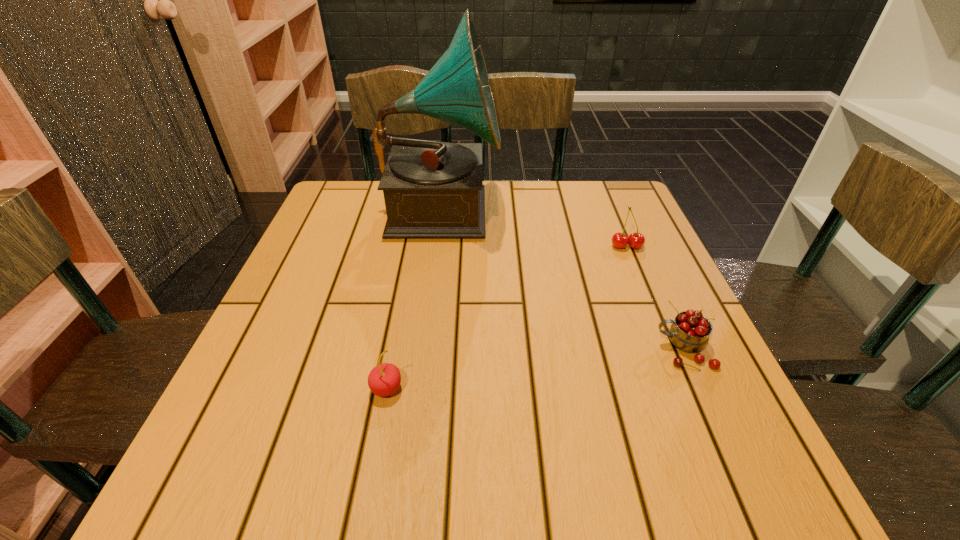
Identify which object is the second nearest to the tallest object. Please provide its 2D coordinates. Your answer should be formatted as a tuple, i.e. [(x, y)], where the tuple contains the x and y coordinates of a point satisfying the conditions above.

[(384, 379)]

Find the location of a particular element. The image size is (960, 540). the closest object relative to the third farthest object is located at coordinates (636, 240).

Select which cherry is the second closest to the farthest cherry. Please provide its 2D coordinates. Your answer should be formatted as a tuple, i.e. [(x, y)], where the tuple contains the x and y coordinates of a point satisfying the conditions above.

[(384, 379)]

Select which cherry appears as the closest to the second farthest cherry. Please provide its 2D coordinates. Your answer should be formatted as a tuple, i.e. [(x, y)], where the tuple contains the x and y coordinates of a point satisfying the conditions above.

[(636, 240)]

Where is `free space that satisfies the following two spatial constraints: 1. on the horn of the tallest object; 2. on the handle side of the second nearest object`? Image resolution: width=960 pixels, height=540 pixels. free space that satisfies the following two spatial constraints: 1. on the horn of the tallest object; 2. on the handle side of the second nearest object is located at coordinates (424, 349).

Find the location of a particular element. Image resolution: width=960 pixels, height=540 pixels. free space that satisfies the following two spatial constraints: 1. with the stems of the farthest cherry pointing upwards; 2. on the handle side of the second nearest cherry is located at coordinates (669, 349).

Image resolution: width=960 pixels, height=540 pixels. Find the location of `free space that satisfies the following two spatial constraints: 1. on the handle side of the second farthest cherry; 2. with the stems of the second farthest object pointing upwards`. free space that satisfies the following two spatial constraints: 1. on the handle side of the second farthest cherry; 2. with the stems of the second farthest object pointing upwards is located at coordinates (637, 246).

This screenshot has height=540, width=960. Identify the location of free space in the image that satisfies the following two spatial constraints: 1. on the handle side of the third farthest object; 2. on the horn of the tallest object. (620, 208).

You are a GUI agent. You are given a task and a screenshot of the screen. Output one action in this format:
    pyautogui.click(x=<x>, y=<y>)
    Task: Click on the free point that satisfies the following two spatial constraints: 1. with the stems of the second farthest object pointing upwards; 2. on the handle side of the second nearest cherry
    The image size is (960, 540).
    Given the screenshot: What is the action you would take?
    pyautogui.click(x=669, y=349)

You are a GUI agent. You are given a task and a screenshot of the screen. Output one action in this format:
    pyautogui.click(x=<x>, y=<y>)
    Task: Click on the free region that satisfies the following two spatial constraints: 1. on the horn of the record player; 2. on the handle side of the third farthest object
    
    Given the screenshot: What is the action you would take?
    pyautogui.click(x=424, y=349)